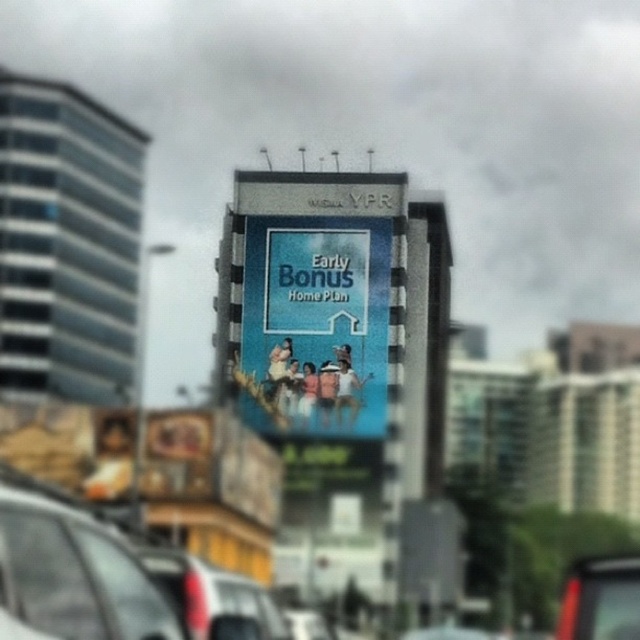
Is the position of blue glossy billboard at center more distant than that of metallic silver car at center?

Yes, blue glossy billboard at center is behind metallic silver car at center.

Does blue glossy billboard at center appear over metallic silver car at center?

Indeed, blue glossy billboard at center is positioned over metallic silver car at center.

I want to click on blue glossy billboard at center, so click(312, 324).

Does matte black car at lower left appear under metallic silver car at center?

Actually, matte black car at lower left is above metallic silver car at center.

Which is behind, point (244, 616) or point (608, 605)?

The point (244, 616) is behind.

Between point (161, 564) and point (620, 611), which one is positioned behind?

The point (161, 564) is behind.

You are a GUI agent. You are given a task and a screenshot of the screen. Output one action in this format:
    pyautogui.click(x=<x>, y=<y>)
    Task: Click on the matte black car at lower left
    
    Given the screenshot: What is the action you would take?
    pyautogui.click(x=211, y=593)

Does blue glossy billboard at center appear over matte black car at lower left?

Yes, blue glossy billboard at center is above matte black car at lower left.

Does blue glossy billboard at center appear on the left side of matte black car at lower left?

In fact, blue glossy billboard at center is to the right of matte black car at lower left.

Between point (381, 291) and point (179, 584), which one is positioned behind?

Point (381, 291)

Where is `blue glossy billboard at center`? The width and height of the screenshot is (640, 640). blue glossy billboard at center is located at coordinates (312, 324).